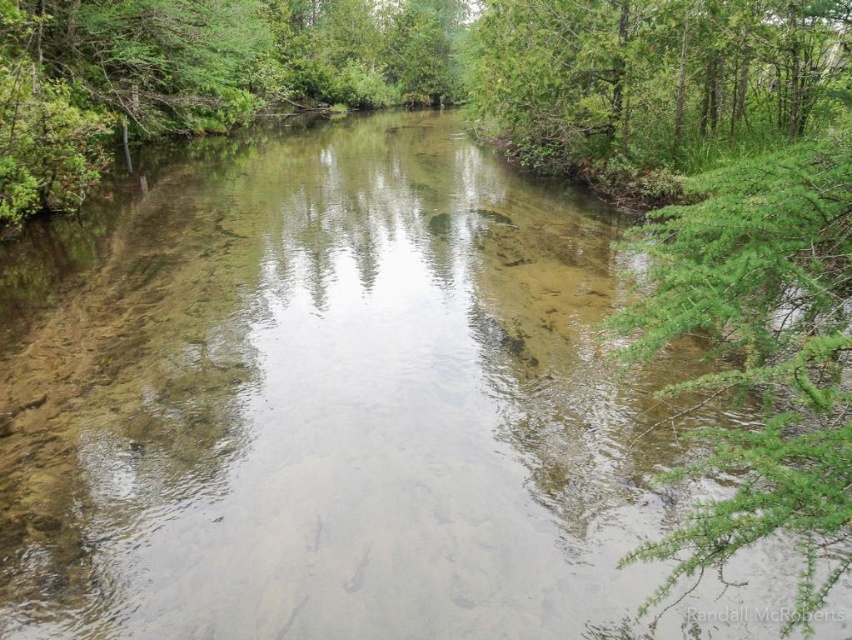
You are an artist trying to sketch the scene. You want to place the green leafy branch at right in your drawing. Where should you position it in terms of coordinates?

The green leafy branch at right should be placed at coordinates approximately 0.552 on the x axis and 0.896 on the y axis.

You are an environmental scientist observing the river. You notice the green leafy branch at right and the green leafy tree at upper right. Which of these two has a smaller visual footprint in the image?

The green leafy branch at right has a smaller visual footprint than the green leafy tree at upper right.

You are standing at the edge of the river and want to throw a stone into the water. You have two options for where to aim based on the coordinates provided. Which point, point (773, 497) or point (648, 81), is closer to you?

Point (773, 497) is closer to the camera than point (648, 81), so it is the closer point to aim for.